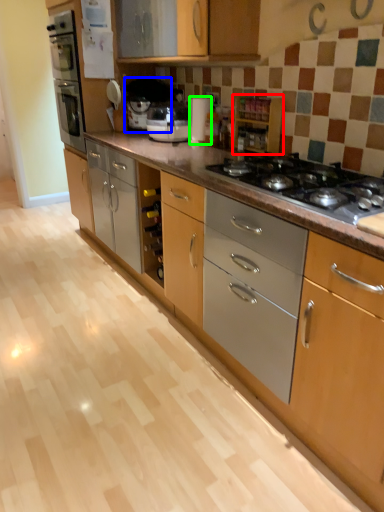
Question: Estimate the real-world distances between objects in this image. Which object is closer to cabinetry (highlighted by a red box), coffee machine (highlighted by a blue box) or appliance (highlighted by a green box)?

Choices:
 (A) coffee machine
 (B) appliance

Answer: (B)